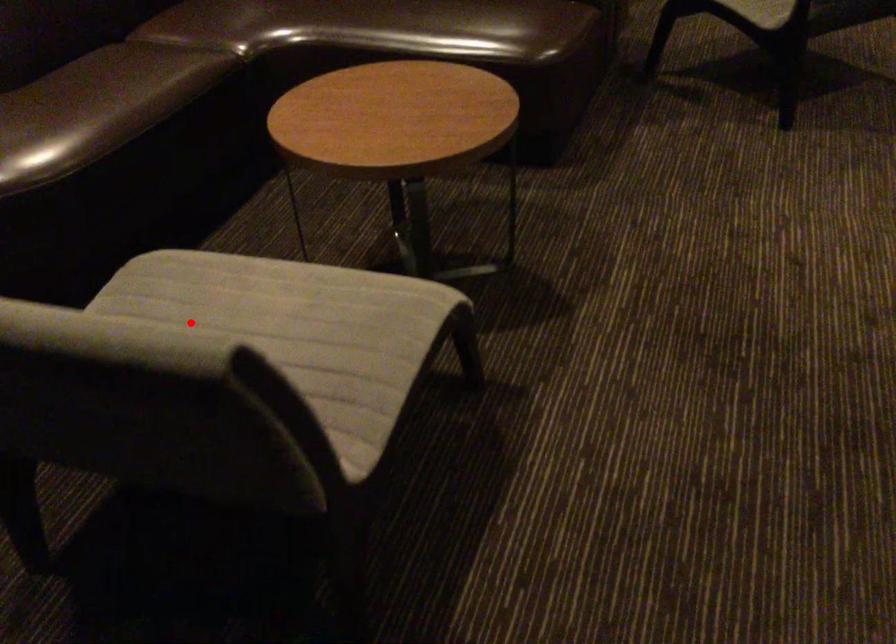
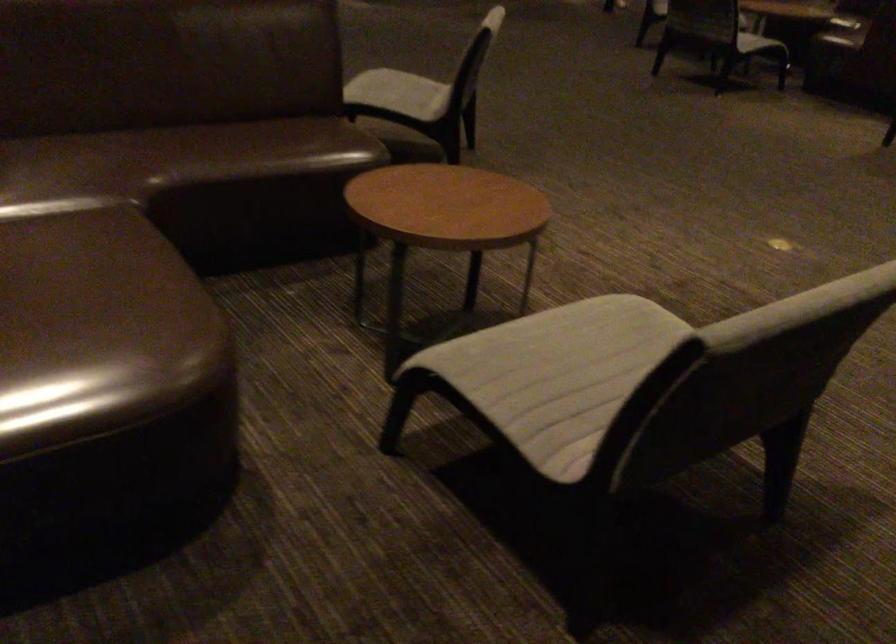
Locate, in the second image, the point that corresponds to the highlighted location in the first image.

(557, 374)